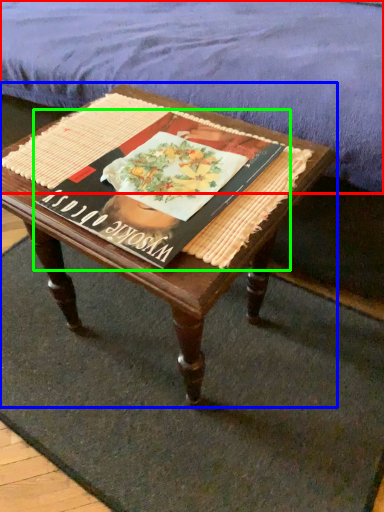
Question: Which object is the closest to the mattress (highlighted by a red box)? Choose among these: coffee table (highlighted by a blue box) or paperback book (highlighted by a green box).

Choices:
 (A) coffee table
 (B) paperback book

Answer: (A)